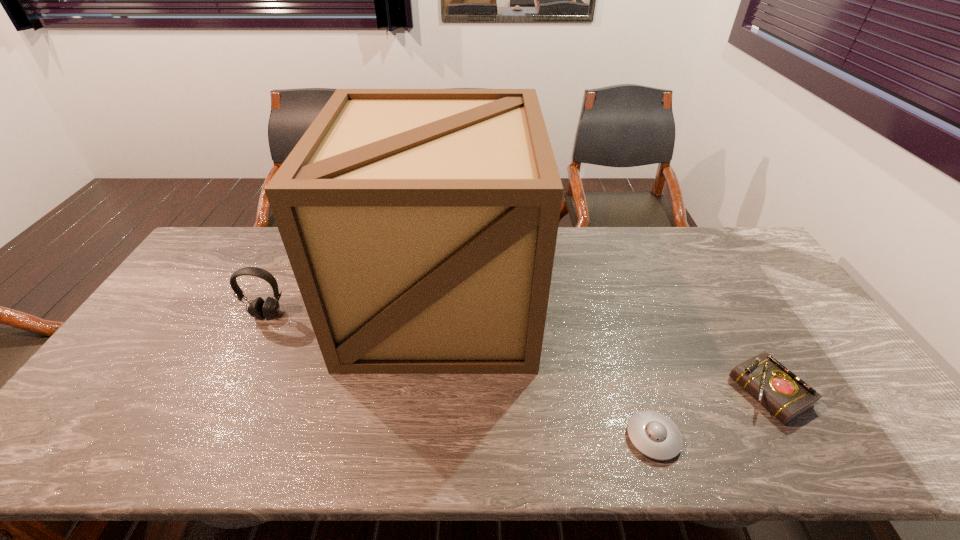
In order to click on free space located on the back of the rightmost object in this screenshot , I will do `click(742, 345)`.

Find the location of a particular element. vacant space located on the left of the saucer is located at coordinates (553, 437).

This screenshot has height=540, width=960. Find the location of `object situated at the far edge`. object situated at the far edge is located at coordinates [x=420, y=224].

In order to click on diary located at the near edge in this screenshot , I will do `click(786, 396)`.

Where is `saucer that is positioned at the near edge`? The height and width of the screenshot is (540, 960). saucer that is positioned at the near edge is located at coordinates (656, 436).

Find the location of a particular element. The image size is (960, 540). object located in the right edge section of the desktop is located at coordinates (786, 396).

This screenshot has width=960, height=540. What are the coordinates of `object situated at the near right corner` in the screenshot? It's located at (786, 396).

This screenshot has height=540, width=960. In order to click on vacant area at the far edge of the desktop in this screenshot , I will do `click(686, 238)`.

Image resolution: width=960 pixels, height=540 pixels. I want to click on free location at the near edge, so click(783, 436).

This screenshot has height=540, width=960. I want to click on vacant region at the left edge of the desktop, so click(x=215, y=280).